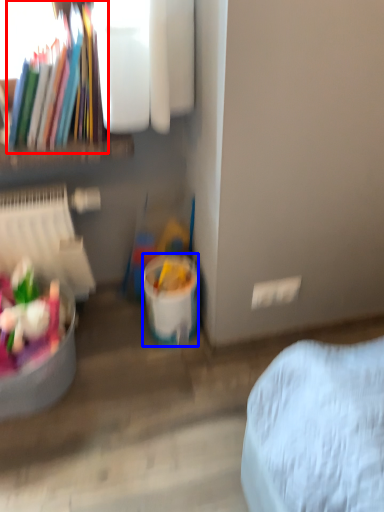
Question: Which of the following is the closest to the observer, book (highlighted by a red box) or bucket (highlighted by a blue box)?

Choices:
 (A) book
 (B) bucket

Answer: (A)